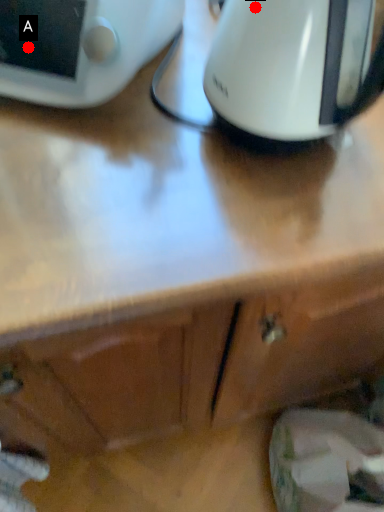
Question: Two points are circled on the image, labeled by A and B beside each circle. Among these points, which one is farthest from the camera?

Choices:
 (A) A is further
 (B) B is further

Answer: (A)